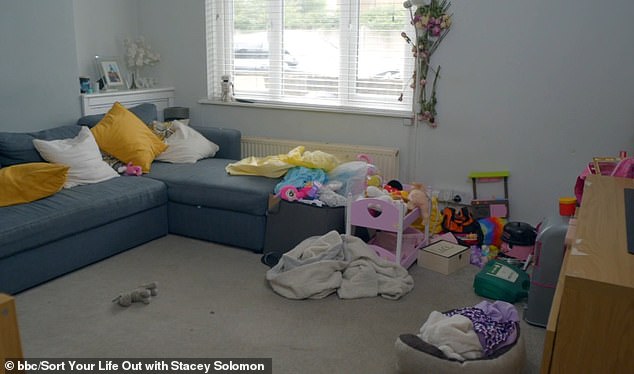
Find the location of `fake flowers`. fake flowers is located at coordinates (434, 22), (146, 44).